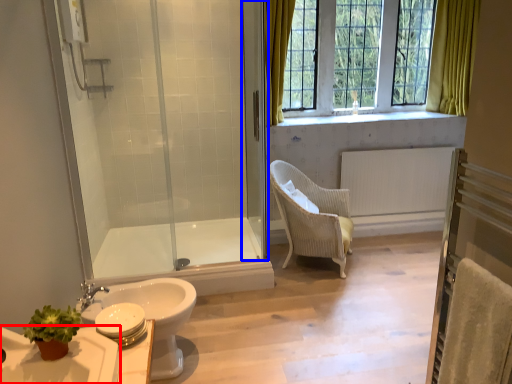
Question: Which object appears farthest to the camera in this image, sink (highlighted by a red box) or screen door (highlighted by a blue box)?

Choices:
 (A) sink
 (B) screen door

Answer: (B)